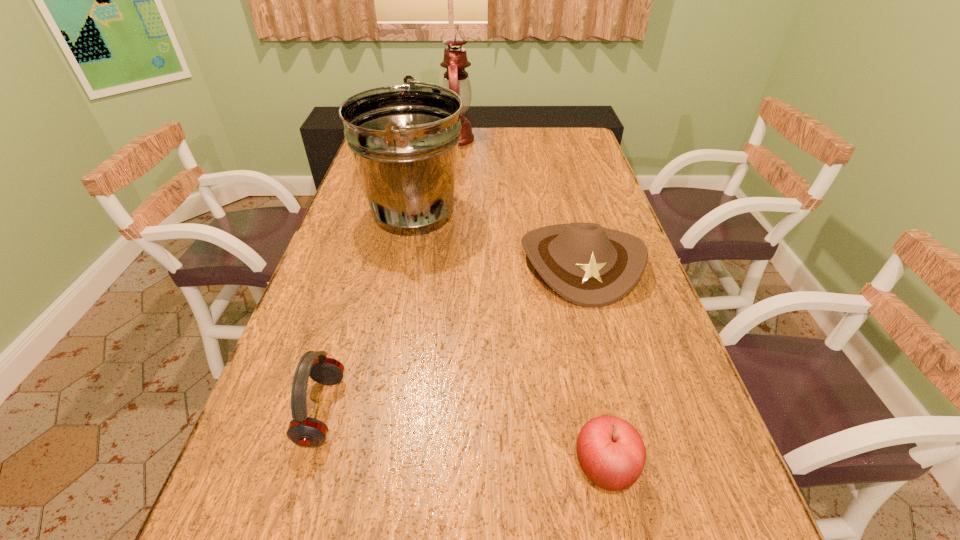
This screenshot has height=540, width=960. I want to click on object that is at the far edge, so click(455, 61).

Identify the location of bucket located at the left edge. The height and width of the screenshot is (540, 960). (404, 139).

The height and width of the screenshot is (540, 960). What are the coordinates of `earphone that is at the left edge` in the screenshot? It's located at (304, 431).

Identify the location of cowboy hat located in the right edge section of the desktop. The height and width of the screenshot is (540, 960). (589, 265).

Identify the location of apple positioned at the right edge. (611, 452).

At what (x,y) coordinates should I click in order to perform the action: click on free space at the far edge of the desktop. Please return your answer as a coordinate pair (x, y). Image resolution: width=960 pixels, height=540 pixels. Looking at the image, I should click on (545, 152).

The height and width of the screenshot is (540, 960). In the image, there is a desktop. In order to click on vacant space at the left edge in this screenshot , I will do 301,332.

The height and width of the screenshot is (540, 960). In order to click on vacant space at the right edge of the desktop in this screenshot , I will do `click(585, 181)`.

In the image, there is a desktop. Identify the location of free space at the far right corner. (580, 148).

Where is `free space between the bucket and the earphone`? The width and height of the screenshot is (960, 540). free space between the bucket and the earphone is located at coordinates (368, 312).